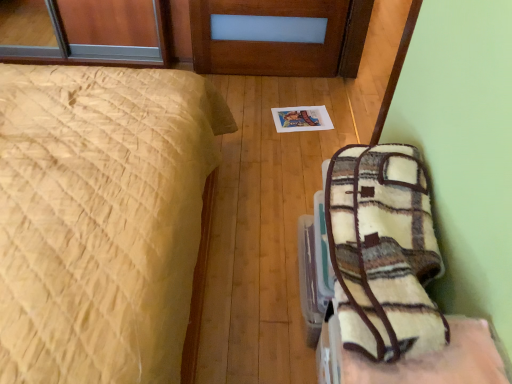
Where is `white fuzzy blanket at lower right`? The width and height of the screenshot is (512, 384). white fuzzy blanket at lower right is located at coordinates (383, 251).

This screenshot has width=512, height=384. Identify the location of plush fleece blanket at lower right. (419, 358).

Can you confirm if white fuzzy blanket at lower right is positioned to the right of plush fleece blanket at lower right?

Indeed, white fuzzy blanket at lower right is positioned on the right side of plush fleece blanket at lower right.

Can you confirm if white fuzzy blanket at lower right is smaller than plush fleece blanket at lower right?

Incorrect, white fuzzy blanket at lower right is not smaller in size than plush fleece blanket at lower right.

Between white fuzzy blanket at lower right and plush fleece blanket at lower right, which one is positioned in front?

white fuzzy blanket at lower right is closer to the camera.

From the image's perspective, is white fuzzy blanket at lower right located beneath plush fleece blanket at lower right?

No.

Looking at this image, does white fuzzy blanket at lower right have a smaller size compared to yellow quilted bed at left?

Correct, white fuzzy blanket at lower right occupies less space than yellow quilted bed at left.

The image size is (512, 384). What are the coordinates of `blanket on the right of the yellow quilted bed at left` in the screenshot? It's located at (383, 251).

From a real-world perspective, is white fuzzy blanket at lower right beneath yellow quilted bed at left?

Incorrect, from a real-world perspective, white fuzzy blanket at lower right is higher than yellow quilted bed at left.

Do you think white fuzzy blanket at lower right is within yellow quilted bed at left, or outside of it?

white fuzzy blanket at lower right lies outside yellow quilted bed at left.

Is plush fleece blanket at lower right facing towards white fuzzy blanket at lower right?

No, plush fleece blanket at lower right is not aimed at white fuzzy blanket at lower right.

Does point (462, 331) come farther from viewer compared to point (346, 269)?

No, (462, 331) is in front of (346, 269).

How many degrees apart are the facing directions of plush fleece blanket at lower right and white fuzzy blanket at lower right?

The angle between the facing direction of plush fleece blanket at lower right and the facing direction of white fuzzy blanket at lower right is 0.000258 degrees.

Between plush fleece blanket at lower right and white fuzzy blanket at lower right, which one has larger size?

white fuzzy blanket at lower right.

Which object is further away from the camera, yellow quilted bed at left or plush fleece blanket at lower right?

plush fleece blanket at lower right is further away from the camera.

Could you tell me if yellow quilted bed at left is turned towards plush fleece blanket at lower right?

Yes.

How different are the orientations of yellow quilted bed at left and plush fleece blanket at lower right in degrees?

They differ by 180 degrees in their facing directions.

Identify the location of furniture to the right of yellow quilted bed at left. (419, 358).

Does yellow quilted bed at left have a lesser height compared to white fuzzy blanket at lower right?

No, yellow quilted bed at left is not shorter than white fuzzy blanket at lower right.

Locate an element on the screen. The image size is (512, 384). blanket on the right of yellow quilted bed at left is located at coordinates (383, 251).

Looking at this image, from the image's perspective, is yellow quilted bed at left on white fuzzy blanket at lower right?

Yes.

Is yellow quilted bed at left at the right side of white fuzzy blanket at lower right?

In fact, yellow quilted bed at left is to the left of white fuzzy blanket at lower right.

Can you confirm if plush fleece blanket at lower right is taller than yellow quilted bed at left?

No, plush fleece blanket at lower right is not taller than yellow quilted bed at left.

Who is smaller, plush fleece blanket at lower right or yellow quilted bed at left?

plush fleece blanket at lower right.

In the scene shown: From a real-world perspective, relative to yellow quilted bed at left, is plush fleece blanket at lower right vertically above or below?

From a real-world perspective, plush fleece blanket at lower right is physically below yellow quilted bed at left.

Can you tell me how much plush fleece blanket at lower right and yellow quilted bed at left differ in facing direction?

180 degrees separate the facing orientations of plush fleece blanket at lower right and yellow quilted bed at left.

Where is `blanket that appears in front of the plush fleece blanket at lower right`? This screenshot has height=384, width=512. blanket that appears in front of the plush fleece blanket at lower right is located at coordinates (383, 251).

The image size is (512, 384). What are the coordinates of `blanket above the yellow quilted bed at left (from a real-world perspective)` in the screenshot? It's located at (383, 251).

Which object lies nearer to the anchor point yellow quilted bed at left, plush fleece blanket at lower right or white fuzzy blanket at lower right?

white fuzzy blanket at lower right is positioned closer to the anchor yellow quilted bed at left.

Considering their positions, is white fuzzy blanket at lower right positioned further to yellow quilted bed at left than plush fleece blanket at lower right?

plush fleece blanket at lower right is further to yellow quilted bed at left.

From the image, which object appears to be nearer to plush fleece blanket at lower right, yellow quilted bed at left or white fuzzy blanket at lower right?

Among the two, white fuzzy blanket at lower right is located nearer to plush fleece blanket at lower right.

Looking at the image, which one is located further to plush fleece blanket at lower right, white fuzzy blanket at lower right or yellow quilted bed at left?

yellow quilted bed at left is further to plush fleece blanket at lower right.

Considering their positions, is yellow quilted bed at left positioned closer to white fuzzy blanket at lower right than plush fleece blanket at lower right?

plush fleece blanket at lower right lies closer to white fuzzy blanket at lower right than the other object.

Considering their positions, is plush fleece blanket at lower right positioned closer to white fuzzy blanket at lower right than yellow quilted bed at left?

The object closer to white fuzzy blanket at lower right is plush fleece blanket at lower right.

The image size is (512, 384). In order to click on furniture between yellow quilted bed at left and white fuzzy blanket at lower right in the horizontal direction in this screenshot , I will do `click(419, 358)`.